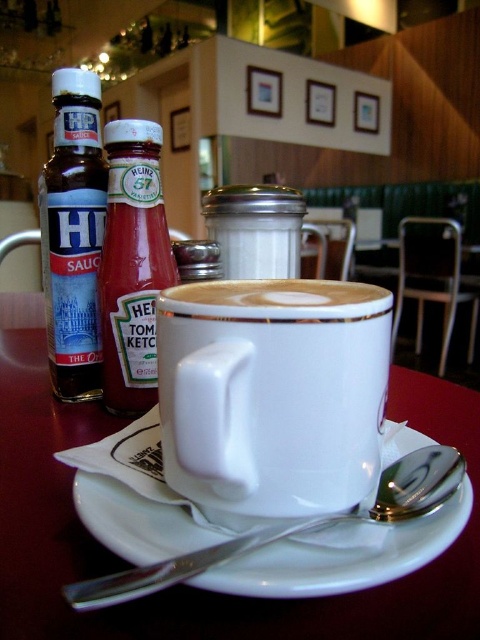
Question: Which object appears closest to the camera in this image?

Choices:
 (A) silver spoon at lower center
 (B) white glossy mug at center
 (C) matte glass hp sauce bottle at left
 (D) white ceramic mug at center

Answer: (A)

Question: Does matte glass hp sauce bottle at left appear on the right side of silver spoon at lower center?

Choices:
 (A) yes
 (B) no

Answer: (B)

Question: Which point is farther to the camera?

Choices:
 (A) (383, 296)
 (B) (20, 387)
 (C) (90, 369)

Answer: (B)

Question: Does red glass bottle of ketchup at left appear on the left side of silver spoon at lower center?

Choices:
 (A) yes
 (B) no

Answer: (A)

Question: Which point is closer to the camera taking this photo?

Choices:
 (A) (372, 468)
 (B) (299, 285)

Answer: (A)

Question: Can you confirm if white ceramic mug at center is positioned to the right of red glass bottle of ketchup at left?

Choices:
 (A) no
 (B) yes

Answer: (B)